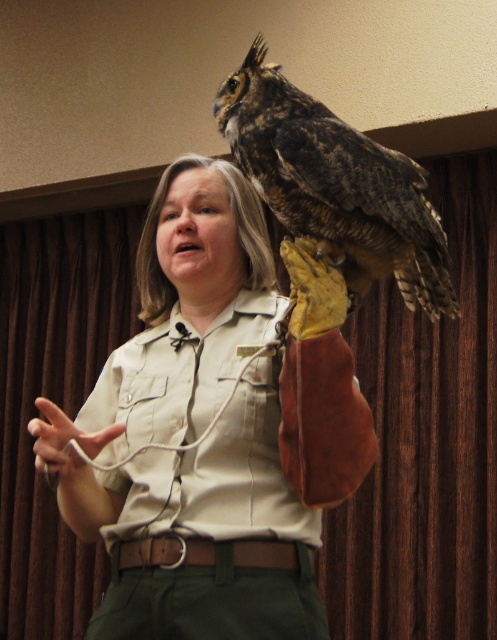
Question: Is beige uniform at upper center to the right of matte khaki shirt at lower left from the viewer's perspective?

Choices:
 (A) yes
 (B) no

Answer: (A)

Question: Which point appears farthest from the camera in this image?

Choices:
 (A) (191, 557)
 (B) (306, 324)
 (C) (65, 504)
 (D) (54, 444)

Answer: (C)

Question: Is brown leather glove at upper right wider than leather glove at upper center?

Choices:
 (A) no
 (B) yes

Answer: (B)

Question: Is leather glove at upper center below white fabric hand at lower left?

Choices:
 (A) yes
 (B) no

Answer: (B)

Question: Which point is closer to the camera?

Choices:
 (A) (204, 609)
 (B) (281, 161)
 (C) (315, 362)

Answer: (C)

Question: Which point appears closest to the camera in this image?

Choices:
 (A) (84, 490)
 (B) (54, 428)
 (C) (293, 272)
 (D) (252, 576)

Answer: (C)